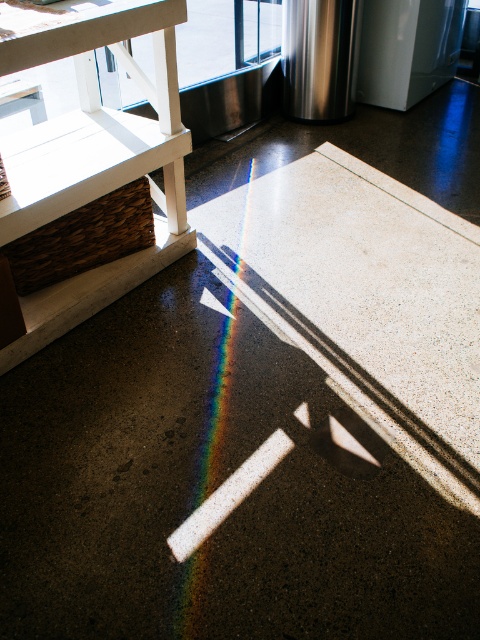
Is transparent glass door at upper center thinner than stainless steel refrigerator at upper right?

Incorrect, transparent glass door at upper center's width is not less than stainless steel refrigerator at upper right's.

Is transparent glass door at upper center positioned behind stainless steel refrigerator at upper right?

Yes, transparent glass door at upper center is behind stainless steel refrigerator at upper right.

The image size is (480, 640). In order to click on transparent glass door at upper center in this screenshot , I will do `click(225, 36)`.

Can you confirm if transparent glass door at upper center is positioned to the left of rainbow at center?

Yes, transparent glass door at upper center is to the left of rainbow at center.

Does transparent glass door at upper center have a smaller size compared to rainbow at center?

Actually, transparent glass door at upper center might be larger than rainbow at center.

Between point (145, 42) and point (187, 611), which one is positioned in front?

Point (187, 611) is in front.

The width and height of the screenshot is (480, 640). Find the location of `transparent glass door at upper center`. transparent glass door at upper center is located at coordinates (225, 36).

Consider the image. Which of these two, stainless steel refrigerator at upper right or rainbow at center, stands taller?

Standing taller between the two is rainbow at center.

Looking at this image, is stainless steel refrigerator at upper right wider than rainbow at center?

Yes.

Image resolution: width=480 pixels, height=640 pixels. In order to click on stainless steel refrigerator at upper right in this screenshot , I will do `click(320, 58)`.

Locate an element on the screen. This screenshot has height=640, width=480. stainless steel refrigerator at upper right is located at coordinates (320, 58).